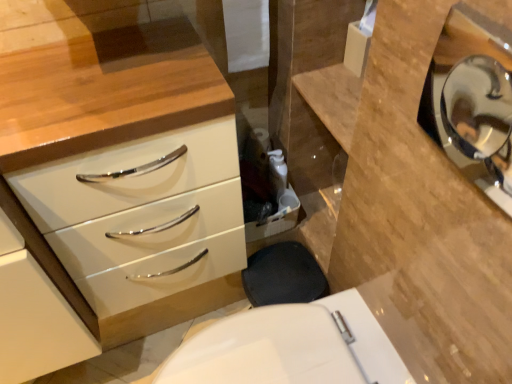
Question: Considering the relative positions of polished silver mirror at upper right and white glossy chest of drawers at left in the image provided, is polished silver mirror at upper right behind white glossy chest of drawers at left?

Choices:
 (A) yes
 (B) no

Answer: (B)

Question: Can you confirm if polished silver mirror at upper right is shorter than white glossy chest of drawers at left?

Choices:
 (A) no
 (B) yes

Answer: (B)

Question: From a real-world perspective, is polished silver mirror at upper right physically below white glossy chest of drawers at left?

Choices:
 (A) yes
 (B) no

Answer: (B)

Question: Is polished silver mirror at upper right at the right side of white glossy chest of drawers at left?

Choices:
 (A) yes
 (B) no

Answer: (A)

Question: Considering the relative sizes of polished silver mirror at upper right and white glossy chest of drawers at left in the image provided, is polished silver mirror at upper right taller than white glossy chest of drawers at left?

Choices:
 (A) no
 (B) yes

Answer: (A)

Question: From a real-world perspective, is polished silver mirror at upper right positioned above or below white glossy chest of drawers at left?

Choices:
 (A) below
 (B) above

Answer: (B)

Question: Choose the correct answer: Is polished silver mirror at upper right inside white glossy chest of drawers at left or outside it?

Choices:
 (A) inside
 (B) outside

Answer: (B)

Question: Looking at their shapes, would you say polished silver mirror at upper right is wider or thinner than white glossy chest of drawers at left?

Choices:
 (A) wide
 (B) thin

Answer: (B)

Question: Considering the positions of point (455, 147) and point (208, 185), is point (455, 147) closer or farther from the camera than point (208, 185)?

Choices:
 (A) farther
 (B) closer

Answer: (A)

Question: Is white glossy toilet at lower center wider or thinner than polished silver mirror at upper right?

Choices:
 (A) wide
 (B) thin

Answer: (A)

Question: From the image's perspective, is white glossy toilet at lower center positioned above or below polished silver mirror at upper right?

Choices:
 (A) above
 (B) below

Answer: (B)

Question: Do you think white glossy toilet at lower center is within polished silver mirror at upper right, or outside of it?

Choices:
 (A) outside
 (B) inside

Answer: (A)

Question: Visually, is white glossy toilet at lower center positioned to the left or to the right of polished silver mirror at upper right?

Choices:
 (A) left
 (B) right

Answer: (A)

Question: From the image's perspective, relative to polished silver mirror at upper right, is white glossy chest of drawers at left above or below?

Choices:
 (A) above
 (B) below

Answer: (B)

Question: In terms of height, does white glossy chest of drawers at left look taller or shorter compared to polished silver mirror at upper right?

Choices:
 (A) tall
 (B) short

Answer: (A)